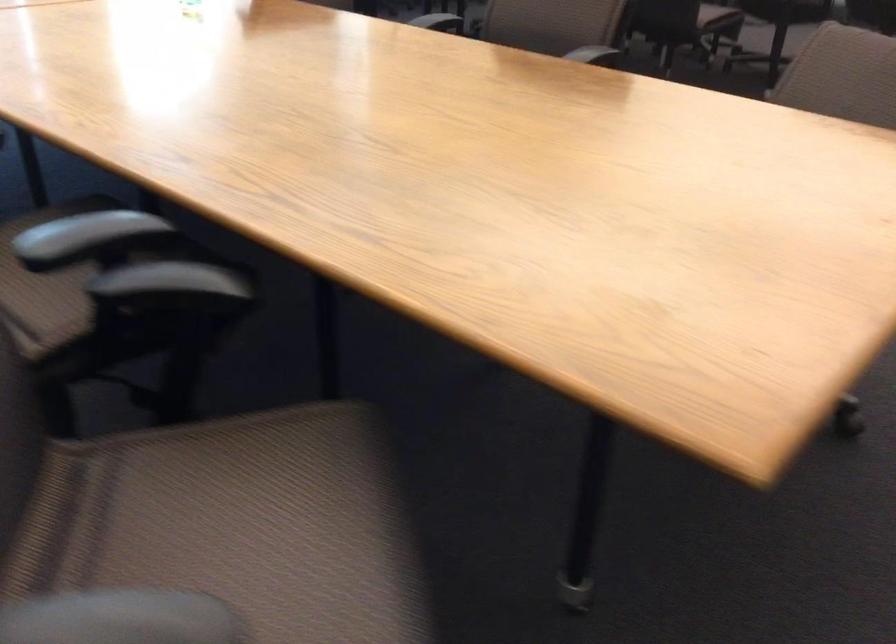
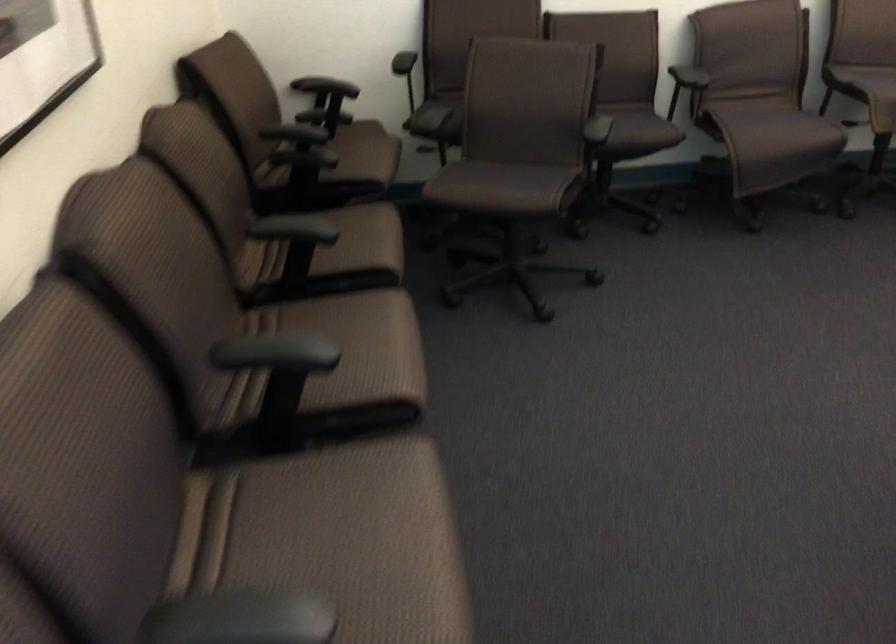
Question: In a continuous first-person perspective shot, in which direction is the camera moving?

Choices:
 (A) Left
 (B) Right
 (C) Forward
 (D) Backward

Answer: (D)